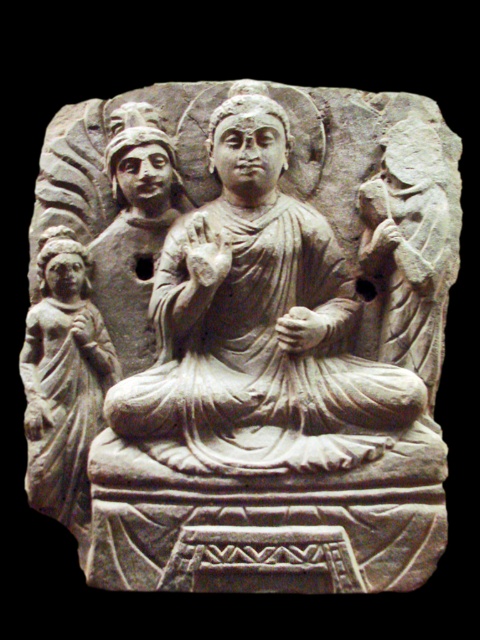
You are an art conservator examining the stone relief sculpture. You need to clean the smooth stone figure at center and the smooth beige statue at lower left. Which one should you start with if you want to work from the closest to the farthest object first?

You should start with the smooth stone figure at center because it is closer to you than the smooth beige statue at lower left, so working from closest to farthest would begin with the central figure.